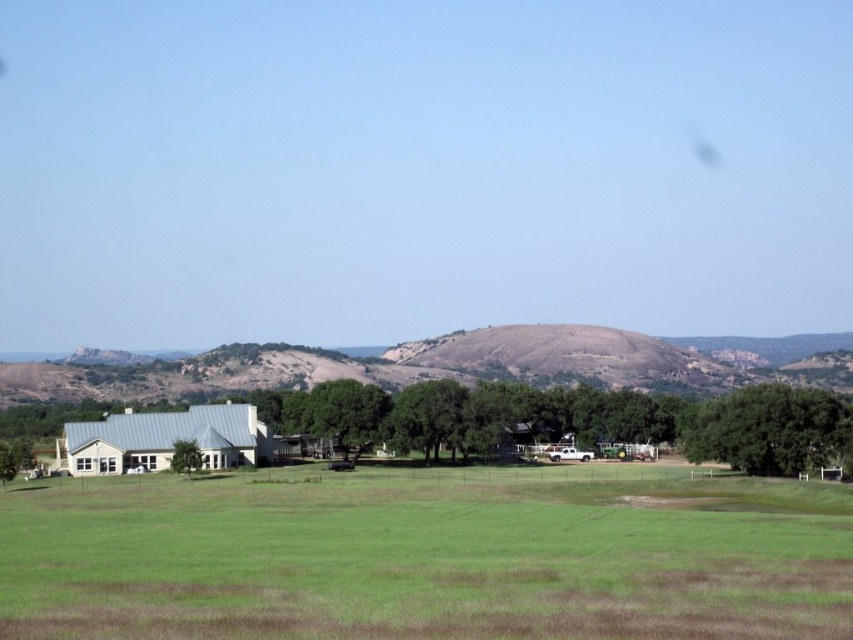
Is brown rocky mountain at center to the right of green leafy tree at center-right from the viewer's perspective?

In fact, brown rocky mountain at center is to the left of green leafy tree at center-right.

Can you confirm if brown rocky mountain at center is taller than green leafy tree at center-right?

Yes.

This screenshot has width=853, height=640. What are the coordinates of `brown rocky mountain at center` in the screenshot? It's located at (440, 364).

In order to click on brown rocky mountain at center in this screenshot , I will do `click(440, 364)`.

Is green grassy field at lower center taller than green leafy tree at lower left?

Indeed, green grassy field at lower center has a greater height compared to green leafy tree at lower left.

Is point (796, 600) behind point (178, 448)?

No, (796, 600) is in front of (178, 448).

At what (x,y) coordinates should I click in order to perform the action: click on green grassy field at lower center. Please return your answer as a coordinate pair (x, y). Looking at the image, I should click on click(427, 556).

Is brown rocky mountain at center to the left of green leafy tree at lower left from the viewer's perspective?

No, brown rocky mountain at center is not to the left of green leafy tree at lower left.

Is brown rocky mountain at center positioned in front of green leafy tree at lower left?

No, brown rocky mountain at center is behind green leafy tree at lower left.

You are a GUI agent. You are given a task and a screenshot of the screen. Output one action in this format:
    pyautogui.click(x=<x>, y=<y>)
    Task: Click on the brown rocky mountain at center
    
    Given the screenshot: What is the action you would take?
    pyautogui.click(x=440, y=364)